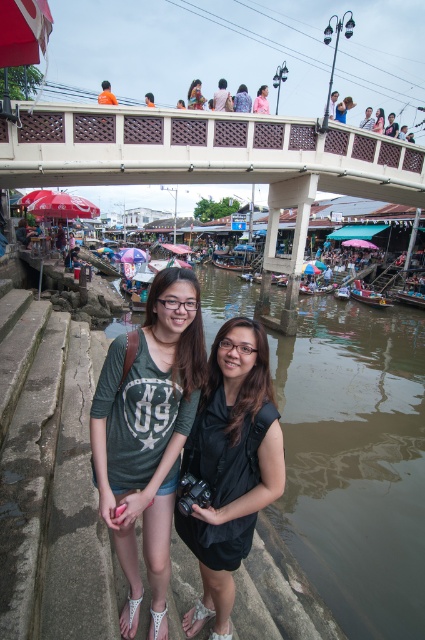
Does brown murky water at lower center appear under green cotton shirt at center?

Actually, brown murky water at lower center is above green cotton shirt at center.

Between point (413, 538) and point (99, 412), which one is positioned in front?

Point (99, 412) is more forward.

Which is in front, point (363, 534) or point (172, 348)?

Point (172, 348)

Identify the location of brown murky water at lower center. This screenshot has height=640, width=425. (354, 460).

Can you confirm if brown murky water at lower center is thinner than white concrete bridge at upper center?

Yes, brown murky water at lower center is thinner than white concrete bridge at upper center.

Image resolution: width=425 pixels, height=640 pixels. Identify the location of brown murky water at lower center. (354, 460).

Is point (237, 493) positioned after point (385, 307)?

No, (237, 493) is closer to viewer.

Is black matte vest at center to the right of wooden polished boat at lower center from the viewer's perspective?

Incorrect, black matte vest at center is not on the right side of wooden polished boat at lower center.

Which is behind, point (206, 435) or point (367, 300)?

Positioned behind is point (367, 300).

Locate an element on the screen. The height and width of the screenshot is (640, 425). black matte vest at center is located at coordinates (231, 465).